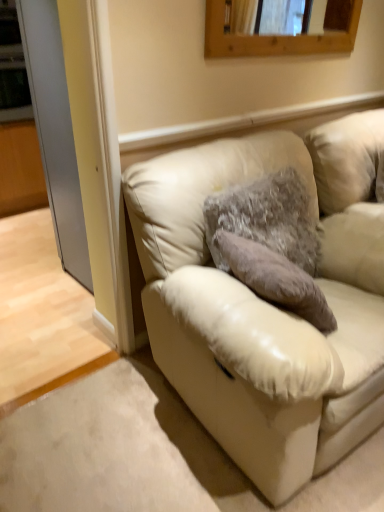
Image resolution: width=384 pixels, height=512 pixels. In order to click on fuzzy fabric pillow at center in this screenshot , I will do point(266,218).

Measure the distance between point (292, 204) and camera.

The depth of point (292, 204) is 5.80 feet.

Image resolution: width=384 pixels, height=512 pixels. What do you see at coordinates (55, 131) in the screenshot?
I see `clear glass door at left` at bounding box center [55, 131].

Describe the element at coordinates (266, 306) in the screenshot. I see `beige leather couch at lower right` at that location.

Identify the location of fuzzy fabric pillow at center. (266, 218).

How different are the orientations of beige leather couch at lower right and clear glass door at left in degrees?

There is a 91.4-degree angle between the facing directions of beige leather couch at lower right and clear glass door at left.

Does beige leather couch at lower right appear on the right side of clear glass door at left?

Indeed, beige leather couch at lower right is positioned on the right side of clear glass door at left.

Which point is more distant from viewer, [342,292] or [53,101]?

The point [53,101] is more distant.

From the image's perspective, is beige leather couch at lower right located above clear glass door at left?

Actually, beige leather couch at lower right appears below clear glass door at left in the image.

From the picture: Is fuzzy fabric pillow at center bigger or smaller than wooden frame at upper center?

In the image, fuzzy fabric pillow at center appears to be larger than wooden frame at upper center.

How different are the orientations of fuzzy fabric pillow at center and wooden frame at upper center in degrees?

The facing directions of fuzzy fabric pillow at center and wooden frame at upper center are 2.78 degrees apart.

Between fuzzy fabric pillow at center and wooden frame at upper center, which one appears on the left side from the viewer's perspective?

fuzzy fabric pillow at center is more to the left.

Considering the sizes of objects fuzzy fabric pillow at center and wooden frame at upper center in the image provided, who is wider, fuzzy fabric pillow at center or wooden frame at upper center?

Wider between the two is fuzzy fabric pillow at center.

Between point (177, 217) and point (276, 50), which one is positioned in front?

The point (177, 217) is in front.

Based on the photo, measure the distance between beige leather couch at lower right and wooden frame at upper center.

beige leather couch at lower right and wooden frame at upper center are 37.03 inches apart.

Is beige leather couch at lower right looking in the opposite direction of wooden frame at upper center?

beige leather couch at lower right is not turned away from wooden frame at upper center.

Is clear glass door at left wider or thinner than beige leather couch at lower right?

Considering their sizes, clear glass door at left looks slimmer than beige leather couch at lower right.

From a real-world perspective, who is located higher, clear glass door at left or beige leather couch at lower right?

clear glass door at left, from a real-world perspective.

Which is closer to the camera, (34, 66) or (143, 188)?

Point (34, 66).

Considering the points (307, 257) and (247, 399), which point is behind, point (307, 257) or point (247, 399)?

Point (307, 257)

Based on the photo, is fuzzy fabric pillow at center positioned in front of beige leather couch at lower right?

No, it is not.

Is fuzzy fabric pillow at center turned away from beige leather couch at lower right?

Yes, fuzzy fabric pillow at center is positioned with its back facing beige leather couch at lower right.

Is clear glass door at left inside or outside of wooden frame at upper center?

clear glass door at left is located beyond the bounds of wooden frame at upper center.

Considering the relative positions of clear glass door at left and wooden frame at upper center in the image provided, is clear glass door at left to the right of wooden frame at upper center from the viewer's perspective?

No.

From the image's perspective, would you say clear glass door at left is shown under wooden frame at upper center?

Correct, clear glass door at left appears lower than wooden frame at upper center in the image.

Is clear glass door at left positioned with its back to wooden frame at upper center?

clear glass door at left is not turned away from wooden frame at upper center.

From a real-world perspective, who is located lower, wooden frame at upper center or beige leather couch at lower right?

beige leather couch at lower right.

Who is taller, wooden frame at upper center or beige leather couch at lower right?

Standing taller between the two is beige leather couch at lower right.

From the image's perspective, is wooden frame at upper center located above or below beige leather couch at lower right?

Clearly, from the image's perspective, wooden frame at upper center is above beige leather couch at lower right.

Is point (357, 4) positioned after point (348, 230)?

Yes.

The image size is (384, 512). I want to click on glass door lying above the beige leather couch at lower right (from the image's perspective), so click(55, 131).

This screenshot has height=512, width=384. I want to click on pillow below the wooden frame at upper center (from a real-world perspective), so click(266, 218).

Considering their positions, is fuzzy fabric pillow at center positioned further to wooden frame at upper center than clear glass door at left?

Based on the image, clear glass door at left appears to be further to wooden frame at upper center.

Which object lies nearer to the anchor point clear glass door at left, wooden frame at upper center or beige leather couch at lower right?

Among the two, wooden frame at upper center is located nearer to clear glass door at left.

When comparing their distances from clear glass door at left, does fuzzy fabric pillow at center or beige leather couch at lower right seem further?

beige leather couch at lower right is further to clear glass door at left.

From the image, which object appears to be nearer to fuzzy fabric pillow at center, wooden frame at upper center or beige leather couch at lower right?

beige leather couch at lower right.

Estimate the real-world distances between objects in this image. Which object is closer to wooden frame at upper center, clear glass door at left or beige leather couch at lower right?

The object closer to wooden frame at upper center is beige leather couch at lower right.

Which object lies nearer to the anchor point wooden frame at upper center, beige leather couch at lower right or fuzzy fabric pillow at center?

The object closer to wooden frame at upper center is fuzzy fabric pillow at center.

Looking at the image, which one is located further to fuzzy fabric pillow at center, clear glass door at left or beige leather couch at lower right?

clear glass door at left.

Looking at this image, estimate the real-world distances between objects in this image. Which object is further from beige leather couch at lower right, wooden frame at upper center or clear glass door at left?

clear glass door at left lies further to beige leather couch at lower right than the other object.

Identify the location of pillow between wooden frame at upper center and beige leather couch at lower right in the up-down direction. (266, 218).

Identify the location of studio couch between clear glass door at left and wooden frame at upper center. The height and width of the screenshot is (512, 384). (266, 306).

At what (x,y) coordinates should I click in order to perform the action: click on pillow between clear glass door at left and wooden frame at upper center in the horizontal direction. Please return your answer as a coordinate pair (x, y). Looking at the image, I should click on (266, 218).

You are a GUI agent. You are given a task and a screenshot of the screen. Output one action in this format:
    pyautogui.click(x=<x>, y=<y>)
    Task: Click on the pillow situated between clear glass door at left and beige leather couch at lower right from left to right
    The width and height of the screenshot is (384, 512).
    Given the screenshot: What is the action you would take?
    pyautogui.click(x=266, y=218)